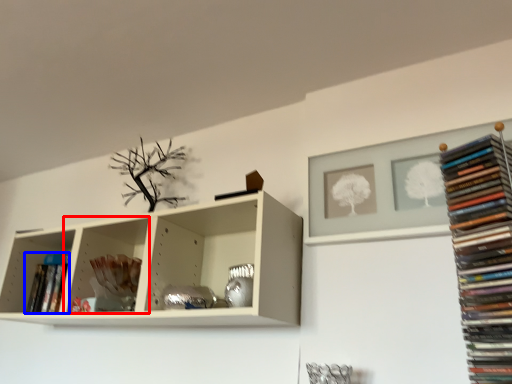
Question: Among these objects, which one is nearest to the camera, shelf (highlighted by a red box) or book (highlighted by a blue box)?

Choices:
 (A) shelf
 (B) book

Answer: (A)